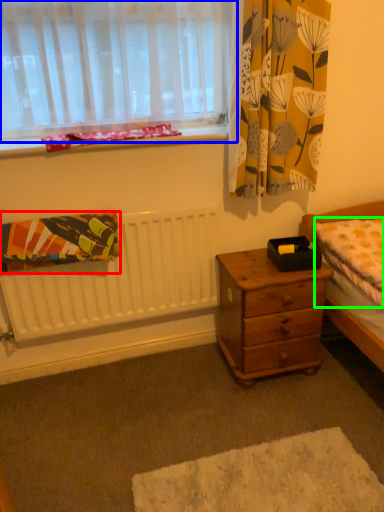
Question: Based on their relative distances, which object is farther from blanket (highlighted by a red box)? Choose from window (highlighted by a blue box) and mattress (highlighted by a green box).

Choices:
 (A) window
 (B) mattress

Answer: (B)